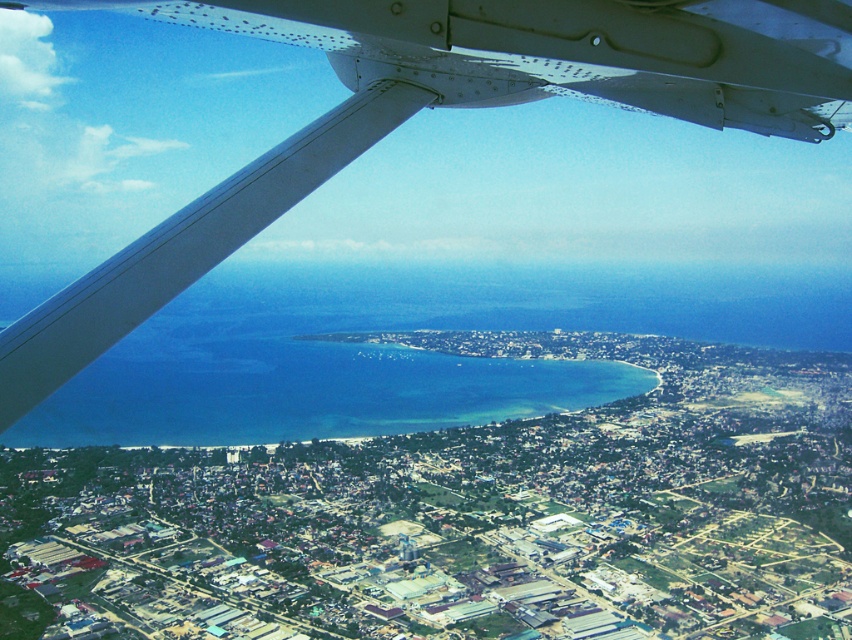
Question: Among these points, which one is farthest from the camera?

Choices:
 (A) (128, 145)
 (B) (306, 396)

Answer: (A)

Question: Can you confirm if white matte wing at upper left is positioned below clear blue water at center?

Choices:
 (A) no
 (B) yes

Answer: (A)

Question: Which point is farther to the camera?

Choices:
 (A) (260, 419)
 (B) (380, 352)

Answer: (A)

Question: Which point is closer to the camera?

Choices:
 (A) clear blue water at center
 (B) white matte wing at upper left

Answer: (B)

Question: Is white matte wing at upper left bigger than clear blue water at center?

Choices:
 (A) yes
 (B) no

Answer: (A)

Question: Can you confirm if white matte wing at upper left is positioned to the right of clear blue water at center?

Choices:
 (A) yes
 (B) no

Answer: (A)